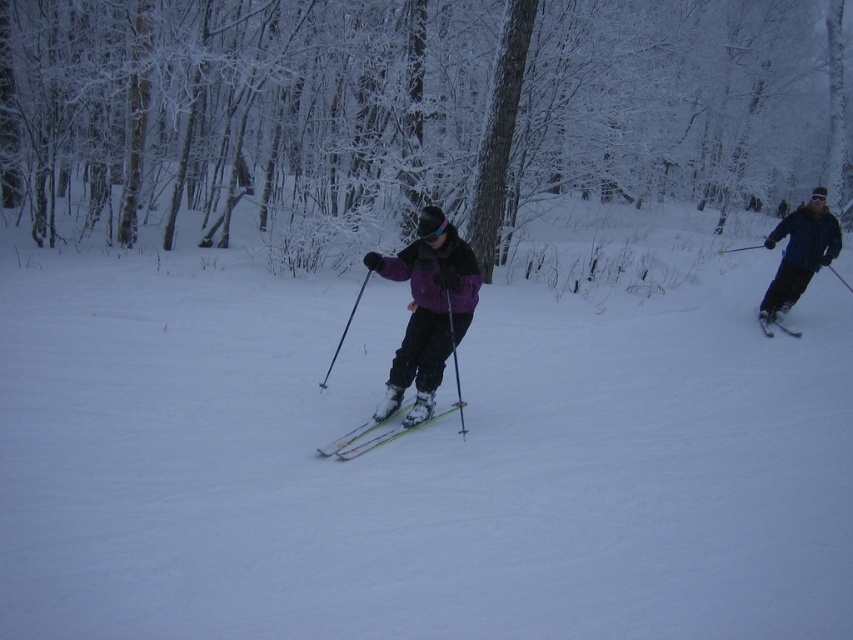
Does white snow ski slope at center come in front of purple fleece jacket at center?

Yes.

Measure the distance from white snow ski slope at center to purple fleece jacket at center.

The distance of white snow ski slope at center from purple fleece jacket at center is 3.01 meters.

Who is more distant from viewer, (517,317) or (459,326)?

The point (517,317) is behind.

I want to click on white snow ski slope at center, so click(424, 451).

In order to click on purple fleece jacket at center in this screenshot , I will do `click(428, 308)`.

Does purple fleece jacket at center appear on the right side of matte black ski at right?

No, purple fleece jacket at center is not to the right of matte black ski at right.

Is point (430, 240) positioned after point (782, 310)?

No.

Locate an element on the screen. Image resolution: width=853 pixels, height=640 pixels. purple fleece jacket at center is located at coordinates (428, 308).

Between point (364, 448) and point (772, 332), which one is positioned in front?

Point (364, 448) is more forward.

Measure the distance between green glossy skis at center and camera.

green glossy skis at center is 6.93 meters from camera.

Is point (397, 412) behind point (769, 316)?

No, (397, 412) is closer to viewer.

Where is `green glossy skis at center`? The image size is (853, 640). green glossy skis at center is located at coordinates (379, 433).